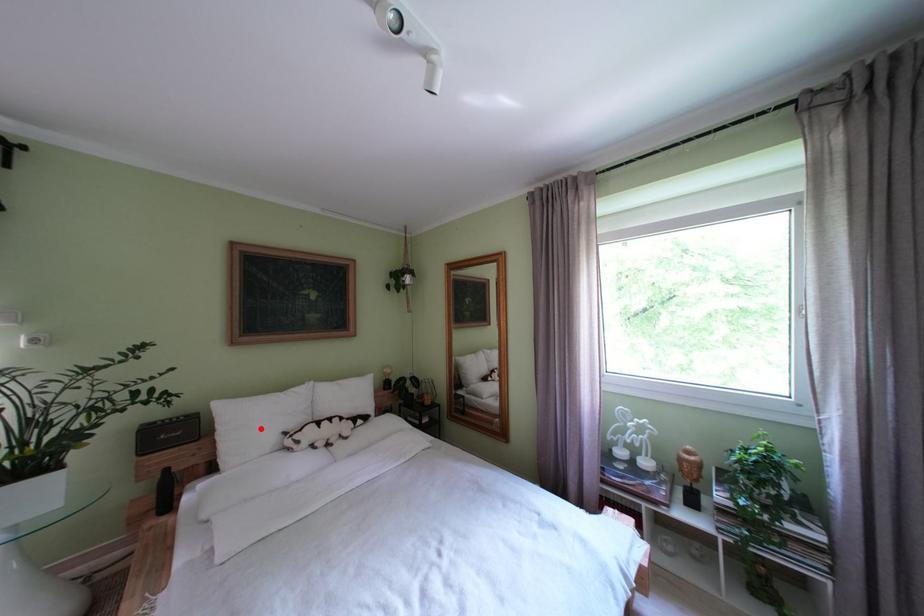
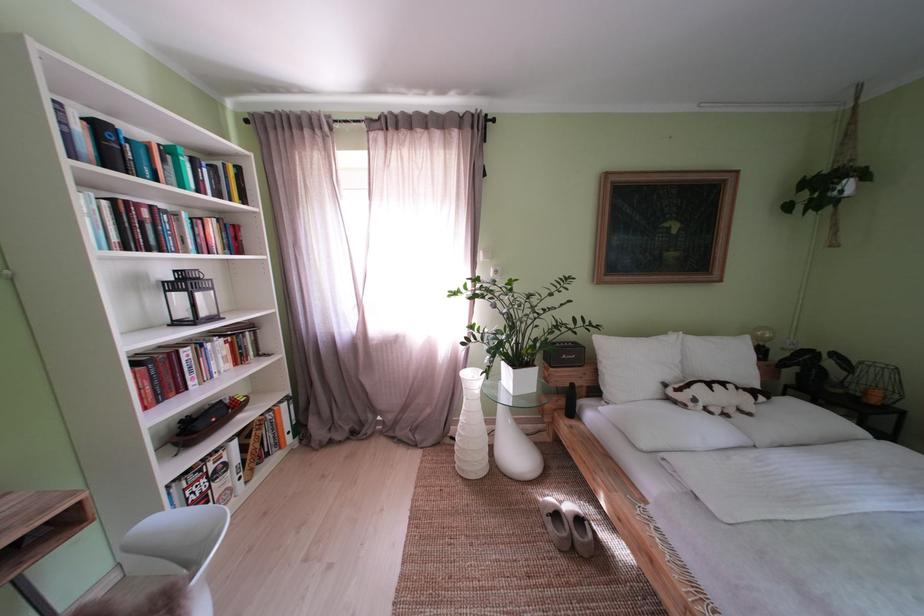
In the second image, find the point that corresponds to the highlighted location in the first image.

(639, 369)